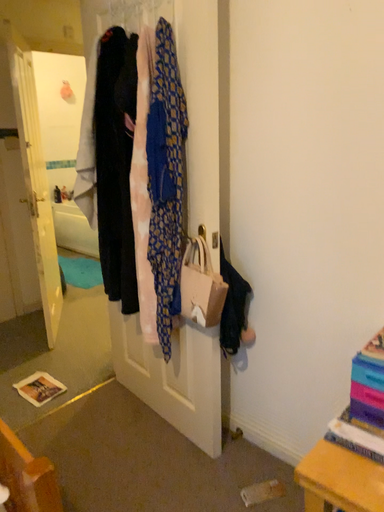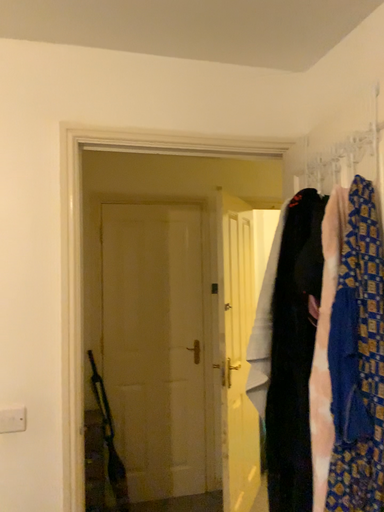
Question: How did the camera likely rotate when shooting the video?

Choices:
 (A) rotated downward
 (B) rotated upward

Answer: (B)